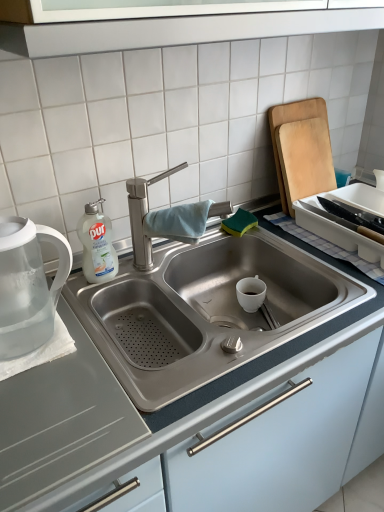
Question: From the image's perspective, does white plastic tray at upper right appear higher than transparent plastic tea pot at left?

Choices:
 (A) no
 (B) yes

Answer: (B)

Question: Is white plastic tray at upper right facing away from transparent plastic tea pot at left?

Choices:
 (A) no
 (B) yes

Answer: (A)

Question: From a real-world perspective, is white plastic tray at upper right physically below transparent plastic tea pot at left?

Choices:
 (A) no
 (B) yes

Answer: (B)

Question: Is white plastic tray at upper right taller than transparent plastic tea pot at left?

Choices:
 (A) no
 (B) yes

Answer: (A)

Question: Can you confirm if white plastic tray at upper right is positioned to the left of transparent plastic tea pot at left?

Choices:
 (A) no
 (B) yes

Answer: (A)

Question: From their relative heights in the image, would you say white plastic tray at upper right is taller or shorter than satin steel sink at center?

Choices:
 (A) short
 (B) tall

Answer: (A)

Question: From the image's perspective, relative to satin steel sink at center, is white plastic tray at upper right above or below?

Choices:
 (A) above
 (B) below

Answer: (A)

Question: Would you say white plastic tray at upper right is to the left or to the right of satin steel sink at center in the picture?

Choices:
 (A) left
 (B) right

Answer: (B)

Question: Considering the positions of white plastic tray at upper right and satin steel sink at center in the image, is white plastic tray at upper right wider or thinner than satin steel sink at center?

Choices:
 (A) wide
 (B) thin

Answer: (B)

Question: In the image, is brushed metal tap at center positioned in front of or behind satin steel sink at center?

Choices:
 (A) behind
 (B) front

Answer: (A)

Question: Does point (145, 190) appear closer or farther from the camera than point (256, 458)?

Choices:
 (A) closer
 (B) farther

Answer: (B)

Question: In terms of size, does brushed metal tap at center appear bigger or smaller than satin steel sink at center?

Choices:
 (A) big
 (B) small

Answer: (B)

Question: Is brushed metal tap at center inside the boundaries of satin steel sink at center, or outside?

Choices:
 (A) inside
 (B) outside

Answer: (B)

Question: Considering the positions of point (86, 238) and point (301, 115), is point (86, 238) closer or farther from the camera than point (301, 115)?

Choices:
 (A) farther
 (B) closer

Answer: (B)

Question: Is white liquid soap at left wider or thinner than wooden cutting board at right?

Choices:
 (A) wide
 (B) thin

Answer: (B)